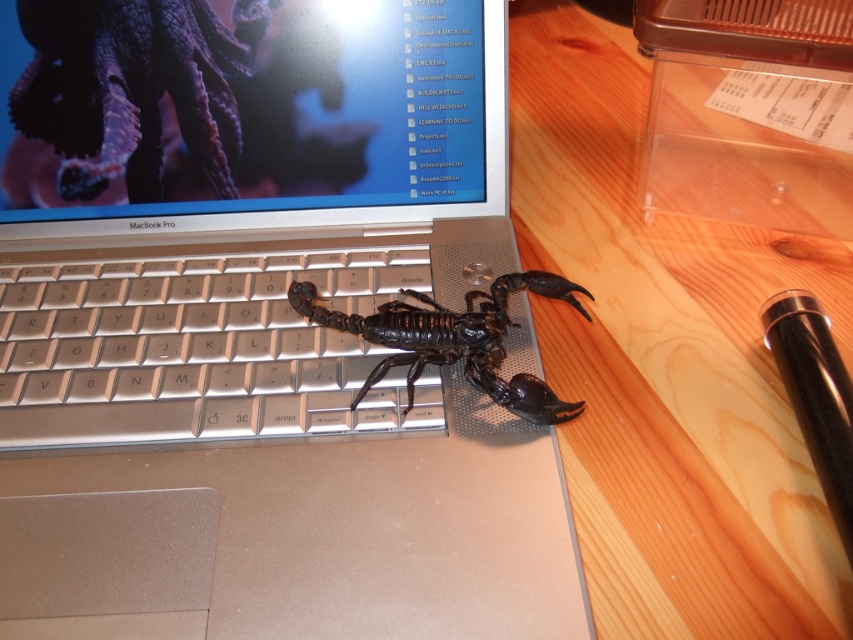
Looking at this image, is glossy plastic screen at upper center wider than purple matte octopus at upper left?

Indeed, glossy plastic screen at upper center has a greater width compared to purple matte octopus at upper left.

Is point (384, 115) more distant than point (103, 28)?

Yes.

Identify the location of glossy plastic screen at upper center. This screenshot has height=640, width=853. (236, 106).

Can you confirm if silver metallic keyboard at center is shorter than black metallic pen at right?

Yes.

Who is shorter, silver metallic keyboard at center or black metallic pen at right?

With less height is silver metallic keyboard at center.

Who is more distant from viewer, (120, 387) or (851, 508)?

The point (120, 387) is behind.

Locate an element on the screen. silver metallic keyboard at center is located at coordinates (196, 349).

Does purple matte octopus at upper left have a larger size compared to black metallic pen at right?

Yes, purple matte octopus at upper left is bigger than black metallic pen at right.

The height and width of the screenshot is (640, 853). What do you see at coordinates (132, 88) in the screenshot? I see `purple matte octopus at upper left` at bounding box center [132, 88].

Locate an element on the screen. This screenshot has height=640, width=853. purple matte octopus at upper left is located at coordinates tap(132, 88).